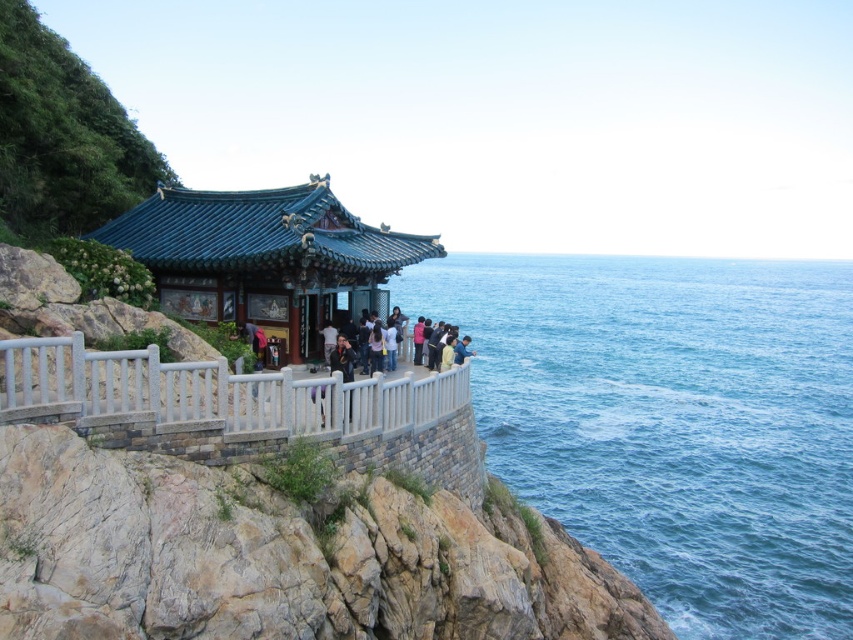
Question: Can you confirm if green glazed tile gazebo at center is positioned below white stone railing at center?

Choices:
 (A) yes
 (B) no

Answer: (B)

Question: Which is nearer to the white stone railing at center?

Choices:
 (A) blue water at center
 (B) green glazed tile gazebo at center
 (C) dark blue fabric jacket at center

Answer: (B)

Question: Which point appears closest to the camera in this image?

Choices:
 (A) (778, 412)
 (B) (198, 378)
 (C) (374, 252)
 (D) (344, 340)

Answer: (B)

Question: Among these objects, which one is farthest from the camera?

Choices:
 (A) white stone railing at center
 (B) blue water at center
 (C) green glazed tile gazebo at center
 (D) dark blue fabric jacket at center

Answer: (B)

Question: Can you confirm if blue water at center is positioned to the right of white stone railing at center?

Choices:
 (A) yes
 (B) no

Answer: (A)

Question: Does white stone railing at center have a greater width compared to dark blue fabric jacket at center?

Choices:
 (A) yes
 (B) no

Answer: (A)